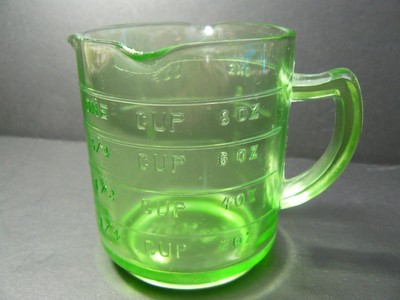
At what (x,y) coordinates should I click in order to perform the action: click on "cup". Please return your answer as a coordinate pair (x, y). The width and height of the screenshot is (400, 300). Looking at the image, I should click on (161, 122), (161, 151), (161, 199), (170, 252).